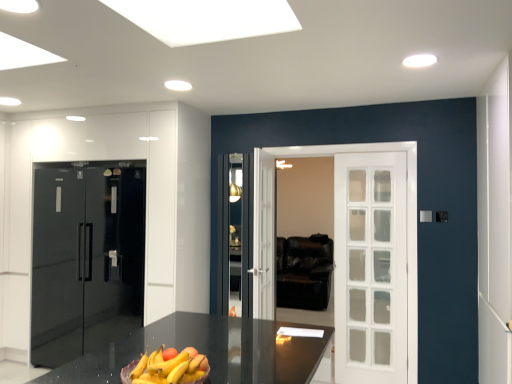
Where is `yellow matte bananas at center`? yellow matte bananas at center is located at coordinates (169, 368).

The image size is (512, 384). Describe the element at coordinates (169, 368) in the screenshot. I see `yellow matte bananas at center` at that location.

Find the location of a particular element. The image size is (512, 384). black glossy refrigerator at left is located at coordinates (86, 257).

The width and height of the screenshot is (512, 384). What do you see at coordinates (86, 257) in the screenshot? I see `black glossy refrigerator at left` at bounding box center [86, 257].

Locate an element on the screen. This screenshot has height=384, width=512. yellow matte bananas at center is located at coordinates (169, 368).

Which is more to the right, yellow matte bananas at center or black glossy refrigerator at left?

yellow matte bananas at center is more to the right.

Considering their positions, is yellow matte bananas at center located in front of or behind black glossy refrigerator at left?

Clearly, yellow matte bananas at center is in front of black glossy refrigerator at left.

Which is nearer, (168,372) or (38,349)?

The point (168,372) is closer to the camera.

From the image's perspective, is yellow matte bananas at center located beneath black glossy refrigerator at left?

No, from the image's perspective, yellow matte bananas at center is not below black glossy refrigerator at left.

From a real-world perspective, is yellow matte bananas at center beneath black glossy refrigerator at left?

Correct, in the physical world, yellow matte bananas at center is lower than black glossy refrigerator at left.

Which of these two, yellow matte bananas at center or black glossy refrigerator at left, is thinner?

yellow matte bananas at center.

Which of these two, yellow matte bananas at center or black glossy refrigerator at left, stands taller?

With more height is black glossy refrigerator at left.

Who is bigger, yellow matte bananas at center or black glossy refrigerator at left?

black glossy refrigerator at left.

From the picture: Would you say yellow matte bananas at center is inside or outside black glossy refrigerator at left?

The correct answer is: outside.

Is yellow matte bananas at center far away from black glossy refrigerator at left?

Indeed, yellow matte bananas at center is not near black glossy refrigerator at left.

Is yellow matte bananas at center positioned with its back to black glossy refrigerator at left?

yellow matte bananas at center does not have its back to black glossy refrigerator at left.

Measure the distance between yellow matte bananas at center and black glossy refrigerator at left.

yellow matte bananas at center and black glossy refrigerator at left are 2.38 meters apart.

This screenshot has width=512, height=384. I want to click on door below the yellow matte bananas at center (from the image's perspective), so click(86, 257).

Considering the positions of objects black glossy refrigerator at left and yellow matte bananas at center in the image provided, who is more to the right, black glossy refrigerator at left or yellow matte bananas at center?

Positioned to the right is yellow matte bananas at center.

In the image, is black glossy refrigerator at left positioned in front of or behind yellow matte bananas at center?

Visually, black glossy refrigerator at left is located behind yellow matte bananas at center.

Is point (121, 192) in front of point (164, 370)?

No, (121, 192) is behind (164, 370).

From the image's perspective, is black glossy refrigerator at left over yellow matte bananas at center?

Incorrect, from the image's perspective, black glossy refrigerator at left is lower than yellow matte bananas at center.

From a real-world perspective, between black glossy refrigerator at left and yellow matte bananas at center, who is vertically lower?

In real-world perspective, yellow matte bananas at center is lower.

Considering the relative sizes of black glossy refrigerator at left and yellow matte bananas at center in the image provided, is black glossy refrigerator at left thinner than yellow matte bananas at center?

In fact, black glossy refrigerator at left might be wider than yellow matte bananas at center.

Looking at this image, from their relative heights in the image, would you say black glossy refrigerator at left is taller or shorter than yellow matte bananas at center?

In the image, black glossy refrigerator at left appears to be taller than yellow matte bananas at center.

Looking at the image, does black glossy refrigerator at left seem bigger or smaller compared to yellow matte bananas at center?

black glossy refrigerator at left is bigger than yellow matte bananas at center.

Do you think black glossy refrigerator at left is within yellow matte bananas at center, or outside of it?

black glossy refrigerator at left is located beyond the bounds of yellow matte bananas at center.

Is black glossy refrigerator at left touching yellow matte bananas at center?

No, black glossy refrigerator at left is not beside yellow matte bananas at center.

Could you tell me if black glossy refrigerator at left is turned towards yellow matte bananas at center?

No, black glossy refrigerator at left is not aimed at yellow matte bananas at center.

How far apart are black glossy refrigerator at left and yellow matte bananas at center?

They are 2.38 meters apart.

Where is `banana on the right of black glossy refrigerator at left`? This screenshot has width=512, height=384. banana on the right of black glossy refrigerator at left is located at coordinates (169, 368).

You are a GUI agent. You are given a task and a screenshot of the screen. Output one action in this format:
    pyautogui.click(x=<x>, y=<y>)
    Task: Click on the banana in front of the black glossy refrigerator at left
    
    Given the screenshot: What is the action you would take?
    pyautogui.click(x=169, y=368)

Find the location of a particular element. door behind the yellow matte bananas at center is located at coordinates (86, 257).